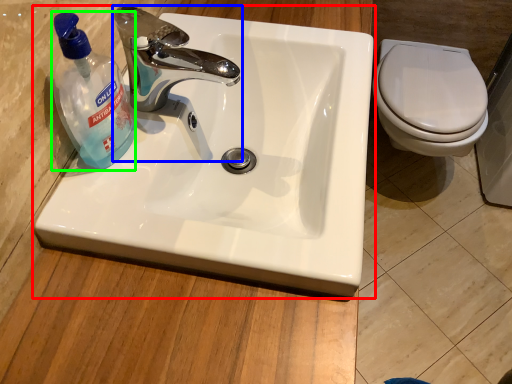
Question: Which is nearer to the sink (highlighted by a red box)? tap (highlighted by a blue box) or cleaning product (highlighted by a green box).

Choices:
 (A) tap
 (B) cleaning product

Answer: (A)